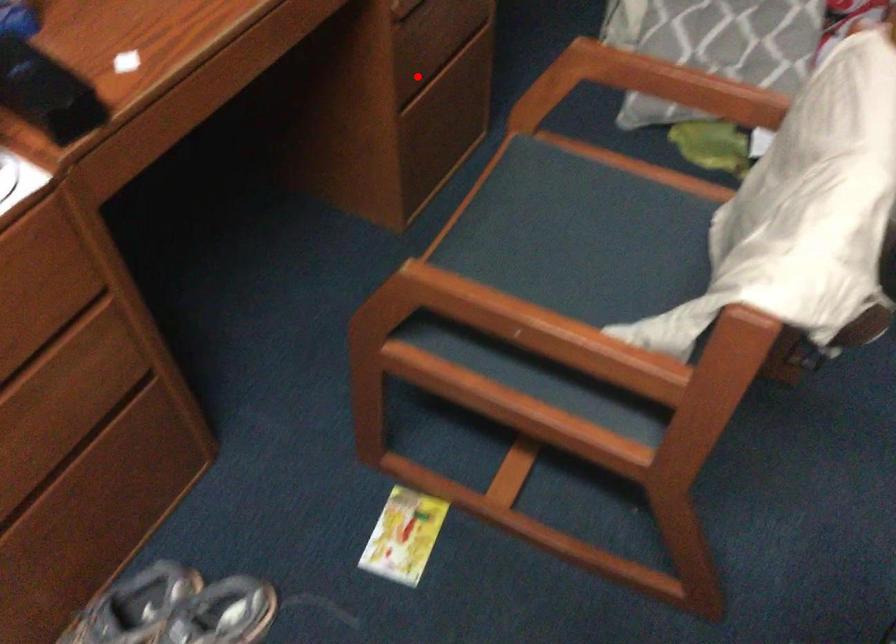
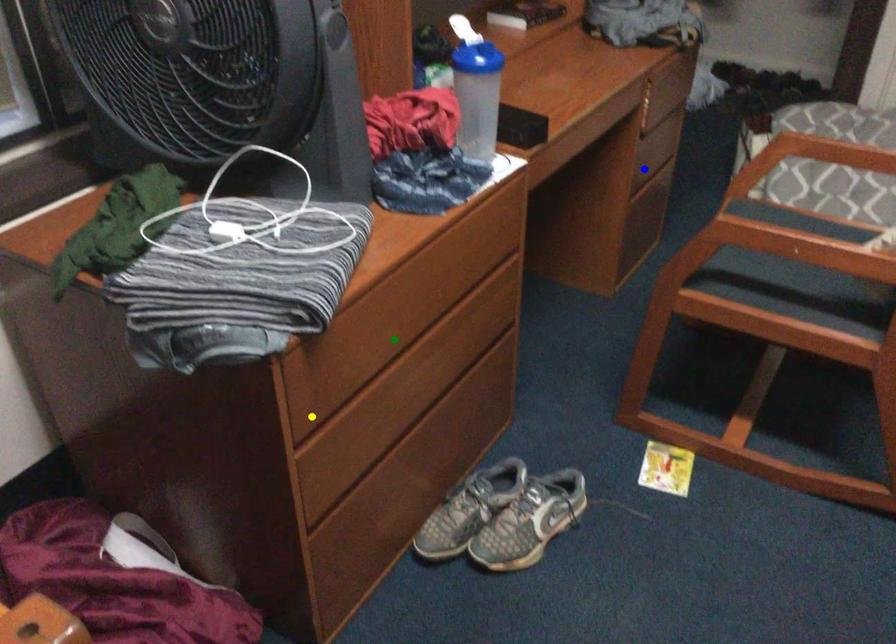
Question: I am providing you with two images of the same scene from different viewpoints. A red point is marked on the first image. You are given multiple points on the second image. Which point in image 2 represents the same 3d spot as the red point in image 1?

Choices:
 (A) yellow point
 (B) blue point
 (C) green point

Answer: (B)